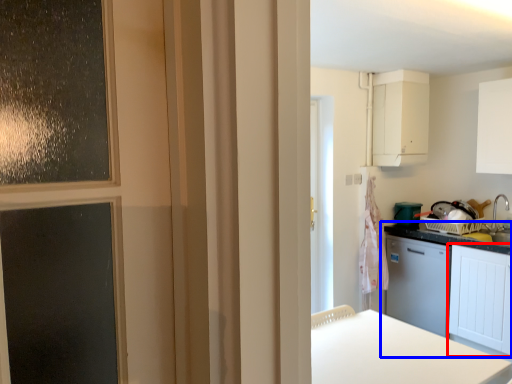
Question: Which point is closer to the camera, cabinetry (highlighted by a red box) or cabinetry (highlighted by a blue box)?

Choices:
 (A) cabinetry
 (B) cabinetry

Answer: (A)